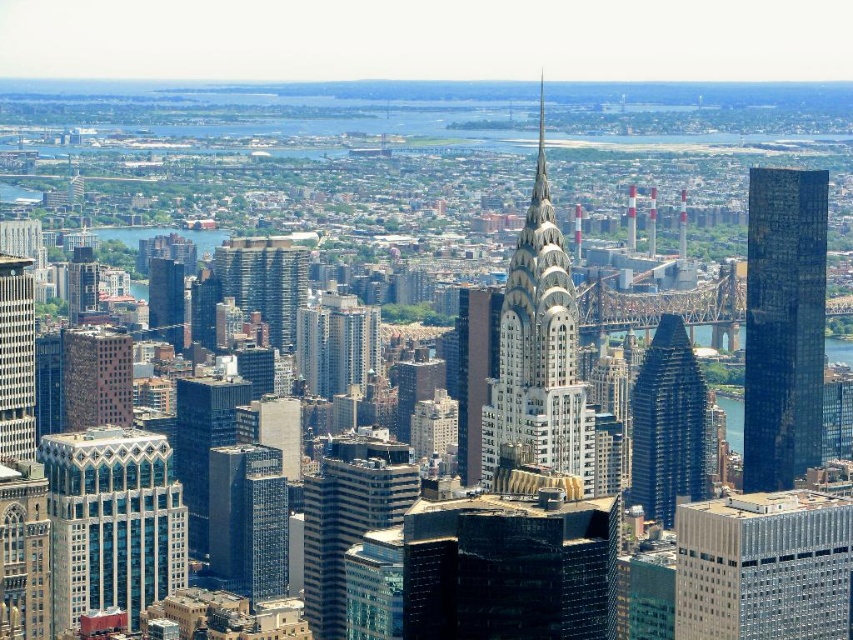
You are an architect evaluating the city skyline. You notice the silver metallic building at lower right and the smooth silver spire at center. Which of these two structures appears bigger in the image?

The silver metallic building at lower right appears bigger in the image as it has a larger size compared to the smooth silver spire at center according to the description.